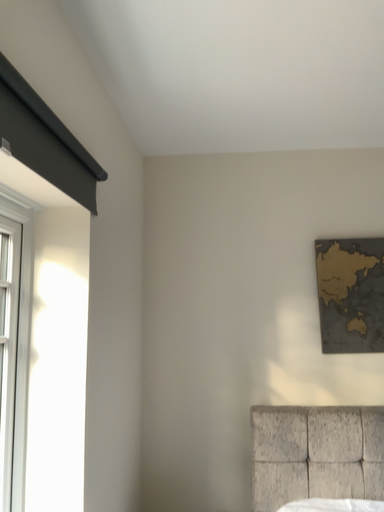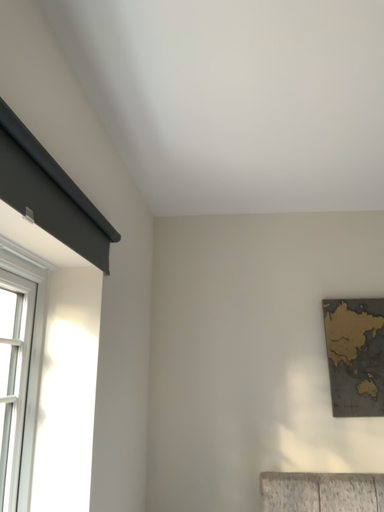
Question: Which way did the camera rotate in the video?

Choices:
 (A) rotated downward
 (B) rotated upward

Answer: (B)